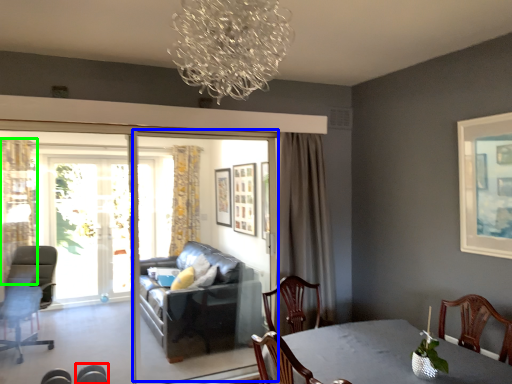
Question: Which object is positioned closest to chair (highlighted by a red box)? Select from screen door (highlighted by a blue box) and curtain (highlighted by a green box).

Choices:
 (A) screen door
 (B) curtain

Answer: (A)